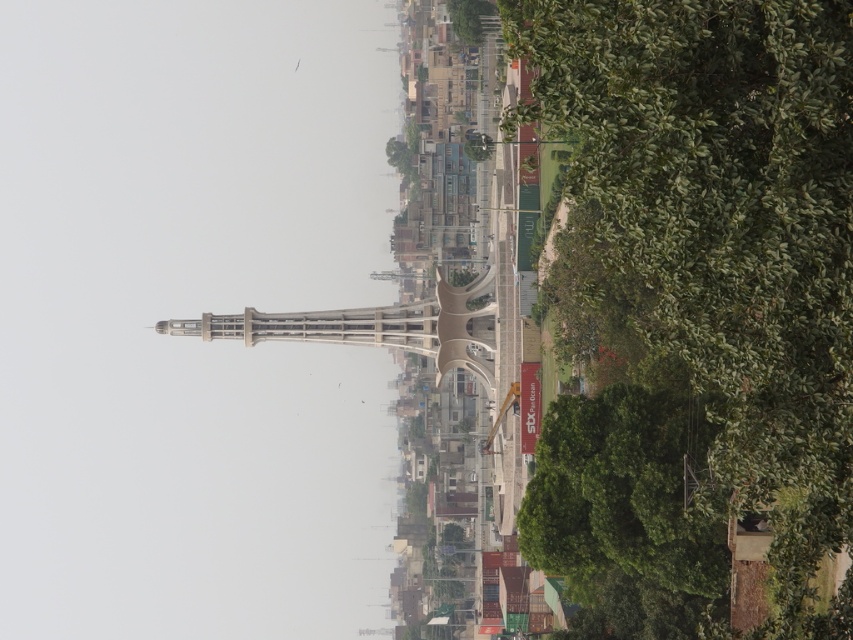
Question: Which of the following is the closest to the observer?

Choices:
 (A) green leafy tree at upper center
 (B) green leafy tree at center

Answer: (B)

Question: Which point is closer to the camera?

Choices:
 (A) green leafy tree at upper center
 (B) green leafy tree at center

Answer: (B)

Question: Observing the image, what is the correct spatial positioning of green leafy tree at center in reference to green leafy tree at upper center?

Choices:
 (A) above
 (B) below

Answer: (B)

Question: Observing the image, what is the correct spatial positioning of green leafy tree at center in reference to green leafy tree at upper center?

Choices:
 (A) below
 (B) above

Answer: (A)

Question: Can you confirm if green leafy tree at center is positioned to the left of green leafy tree at upper center?

Choices:
 (A) yes
 (B) no

Answer: (B)

Question: Which of the following is the farthest from the observer?

Choices:
 (A) green leafy tree at upper center
 (B) green leafy tree at center

Answer: (A)